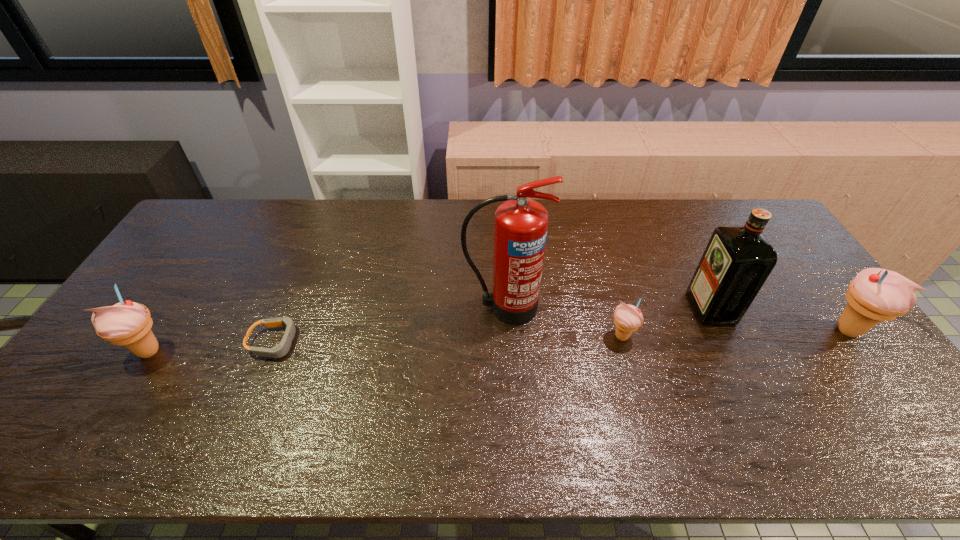
What are the coordinates of `the fourth tallest object` in the screenshot? It's located at coord(127,323).

This screenshot has width=960, height=540. In order to click on the leftmost icecream in this screenshot , I will do `click(127, 323)`.

The width and height of the screenshot is (960, 540). I want to click on the second shortest object, so click(x=627, y=318).

Locate an element on the screen. The image size is (960, 540). the second icecream from right to left is located at coordinates (627, 318).

In order to click on the rightmost icecream in this screenshot , I will do `click(875, 295)`.

Where is `the fifth object from left to right`? Image resolution: width=960 pixels, height=540 pixels. the fifth object from left to right is located at coordinates (737, 261).

Identify the location of the fifth shortest object. This screenshot has height=540, width=960. (737, 261).

Identify the location of the fourth object from right to left. (520, 228).

Locate an element on the screen. The height and width of the screenshot is (540, 960). the tallest object is located at coordinates (520, 228).

The height and width of the screenshot is (540, 960). I want to click on the shortest object, so click(x=280, y=350).